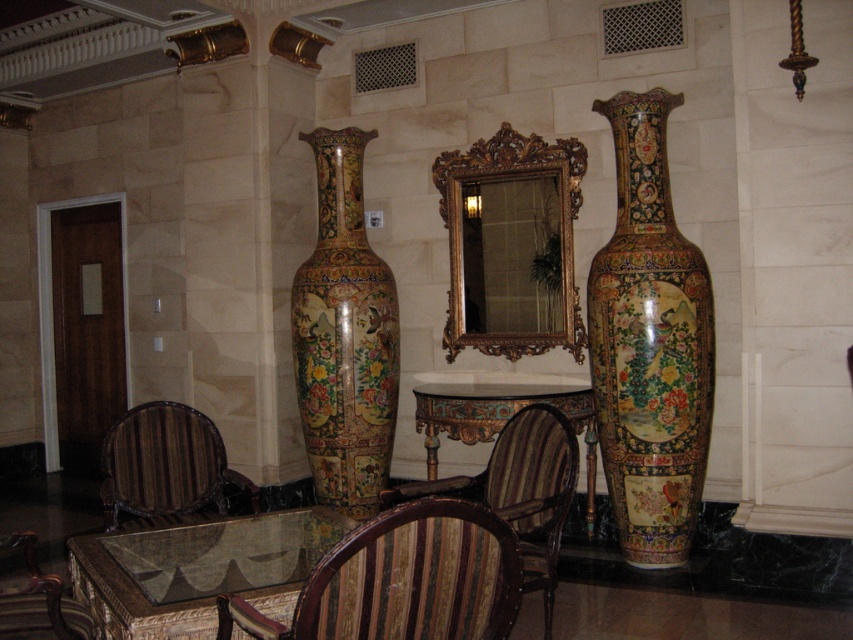
Question: Does wooden chair at center have a lesser width compared to carved wood table at center?

Choices:
 (A) no
 (B) yes

Answer: (B)

Question: Which of the following is the farthest from the observer?

Choices:
 (A) glass polished wood table at center
 (B) decorative ceramic vase at right
 (C) painted ceramic vase at center
 (D) striped fabric chair at center

Answer: (C)

Question: Is decorative ceramic vase at right to the right of striped fabric chair at lower left from the viewer's perspective?

Choices:
 (A) no
 (B) yes

Answer: (B)

Question: Which of these objects is positioned closest to the striped fabric chair at center?

Choices:
 (A) gold ornate mirror at center
 (B) carved wood table at center
 (C) glass polished wood table at center
 (D) striped fabric chair at lower left

Answer: (C)

Question: In this image, where is decorative ceramic vase at right located relative to wooden chair at center?

Choices:
 (A) below
 (B) above

Answer: (B)

Question: Which of the following is the closest to the observer?

Choices:
 (A) decorative ceramic vase at right
 (B) wooden chair at center
 (C) painted ceramic vase at center
 (D) striped fabric chair at center

Answer: (B)